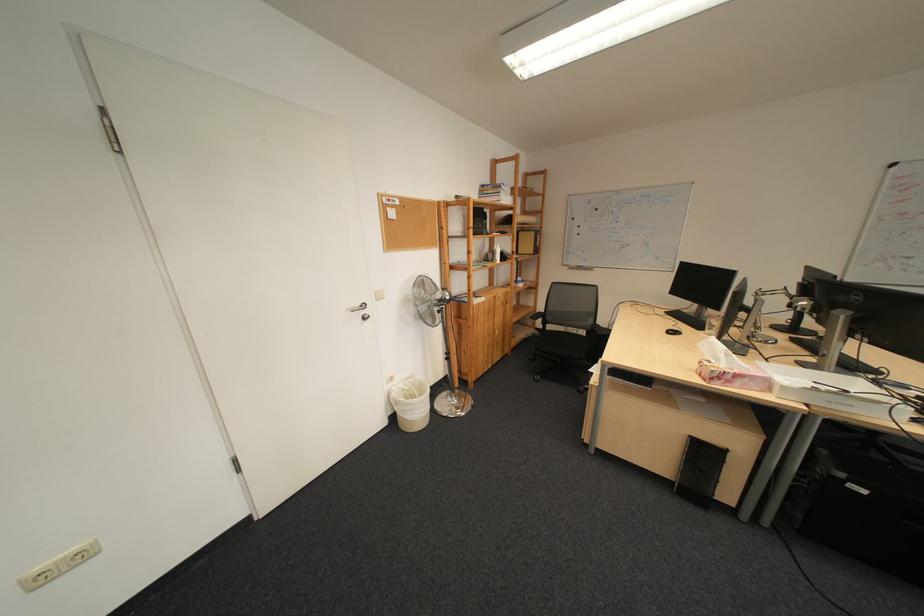
I want to click on white light switch, so click(58, 565).